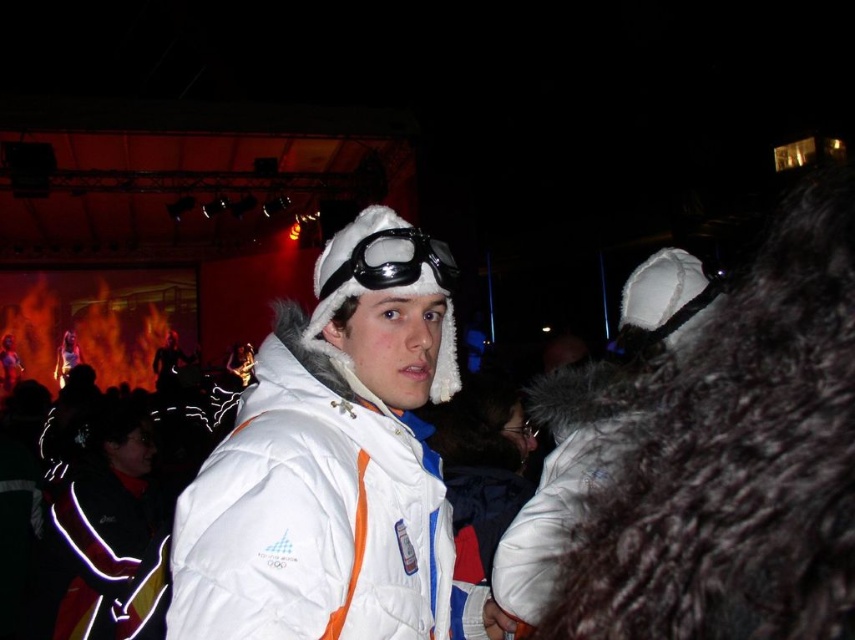
Question: Does white puffy jacket at center appear on the left side of white fur goggles at center?

Choices:
 (A) yes
 (B) no

Answer: (A)

Question: Does white fur coat at center appear over white fur goggles at center?

Choices:
 (A) no
 (B) yes

Answer: (A)

Question: Which point appears farthest from the camera in this image?

Choices:
 (A) (293, 474)
 (B) (357, 269)

Answer: (B)

Question: Which point is closer to the camera taking this photo?

Choices:
 (A) (335, 282)
 (B) (540, 522)

Answer: (A)

Question: Estimate the real-world distances between objects in this image. Which object is closer to the white puffy jacket at center?

Choices:
 (A) white fur coat at center
 (B) white fur goggles at center

Answer: (B)

Question: Does white puffy jacket at center appear over white fur coat at center?

Choices:
 (A) no
 (B) yes

Answer: (A)